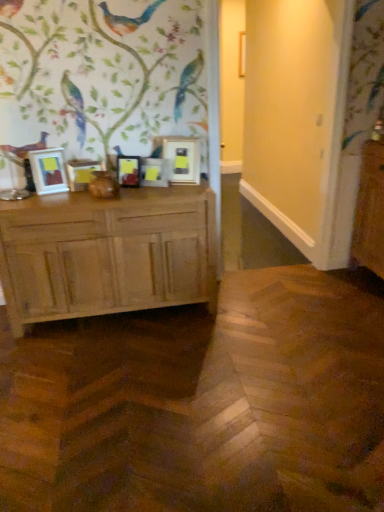
Question: Are matte wooden picture frame at center, which is the 4th picture frame from left to right, and matte black picture frame at center, which ranks as the third picture frame in left-to-right order, located far from each other?

Choices:
 (A) yes
 (B) no

Answer: (B)

Question: From a real-world perspective, is matte wooden picture frame at center, which is the 4th picture frame from left to right, on top of matte black picture frame at center, which is the 3th picture frame from right to left?

Choices:
 (A) yes
 (B) no

Answer: (B)

Question: Can you confirm if matte wooden picture frame at center, which is the 4th picture frame from left to right, is wider than matte black picture frame at center, which ranks as the third picture frame in left-to-right order?

Choices:
 (A) no
 (B) yes

Answer: (A)

Question: Is matte wooden picture frame at center, which is the 4th picture frame from left to right, to the right of matte black picture frame at center, which is the 3th picture frame from right to left, from the viewer's perspective?

Choices:
 (A) no
 (B) yes

Answer: (B)

Question: Is matte wooden picture frame at center, which is the 4th picture frame from left to right, thinner than matte black picture frame at center, which is the 3th picture frame from right to left?

Choices:
 (A) no
 (B) yes

Answer: (B)

Question: Considering the relative positions of matte gold picture frame at center, which is the first picture frame from right to left, and matte black picture frame at center, which is the 3th picture frame from right to left, in the image provided, is matte gold picture frame at center, which is the first picture frame from right to left, to the left or to the right of matte black picture frame at center, which is the 3th picture frame from right to left,?

Choices:
 (A) left
 (B) right

Answer: (B)

Question: In the image, is matte gold picture frame at center, which is the first picture frame from right to left, positioned in front of or behind matte black picture frame at center, which ranks as the third picture frame in left-to-right order?

Choices:
 (A) front
 (B) behind

Answer: (A)

Question: In terms of width, does matte gold picture frame at center, the fifth picture frame from the left, look wider or thinner when compared to matte black picture frame at center, which ranks as the third picture frame in left-to-right order?

Choices:
 (A) thin
 (B) wide

Answer: (B)

Question: Is point (188, 151) positioned closer to the camera than point (135, 176)?

Choices:
 (A) farther
 (B) closer

Answer: (A)

Question: From the image's perspective, is matte wooden picture frame at left, which is the 5th picture frame from right to left, above or below light brown wood chest of drawers at left?

Choices:
 (A) below
 (B) above

Answer: (B)

Question: Is matte wooden picture frame at left, which is the 5th picture frame from right to left, wider or thinner than light brown wood chest of drawers at left?

Choices:
 (A) thin
 (B) wide

Answer: (A)

Question: In terms of size, does matte wooden picture frame at left, which is the 5th picture frame from right to left, appear bigger or smaller than light brown wood chest of drawers at left?

Choices:
 (A) small
 (B) big

Answer: (A)

Question: From a real-world perspective, is matte wooden picture frame at left, which is the 5th picture frame from right to left, above or below light brown wood chest of drawers at left?

Choices:
 (A) above
 (B) below

Answer: (A)

Question: Is matte wooden picture frame at center, which is the 4th picture frame from left to right, wider or thinner than light brown wood chest of drawers at left?

Choices:
 (A) wide
 (B) thin

Answer: (B)

Question: From a real-world perspective, is matte wooden picture frame at center, which is counted as the 2th picture frame, starting from the right, physically located above or below light brown wood chest of drawers at left?

Choices:
 (A) above
 (B) below

Answer: (A)